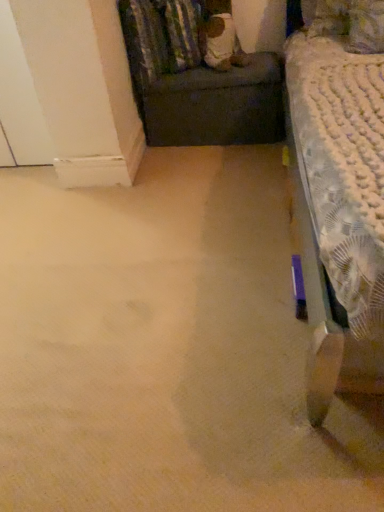
The height and width of the screenshot is (512, 384). Find the location of `free space in front of dark fabric ottoman at upper center`. free space in front of dark fabric ottoman at upper center is located at coordinates (215, 177).